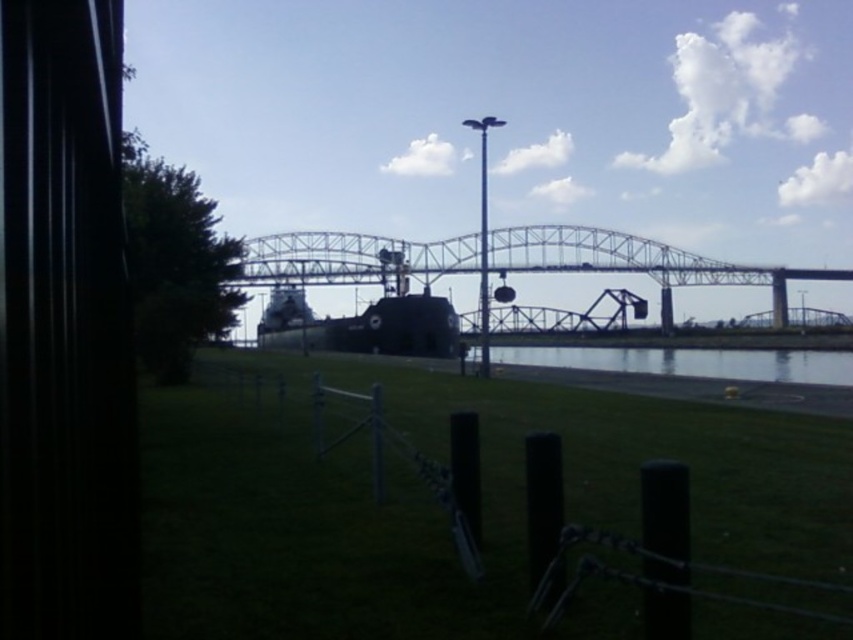
You are standing in the scene and want to walk to the clear water at center. Which direction should you move relative to the green grass at center?

You should move away from the green grass at center because the green grass at center is in front of the clear water at center, meaning the water is behind the grass from your perspective.

You are standing in the grassy area enclosed by the wire fence. You see two points marked on the bridge, point (840, 472) and point (438, 253). Which point is closer to you?

Point (840, 472) is closer to the viewer than point (438, 253).